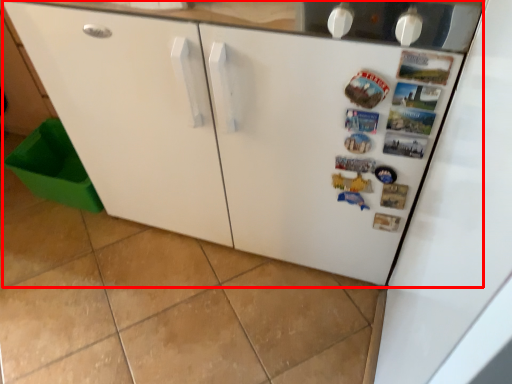
Question: Observing the image, what is the correct spatial positioning of refrigerator (annotated by the red box) in reference to cabinetry?

Choices:
 (A) left
 (B) right

Answer: (B)